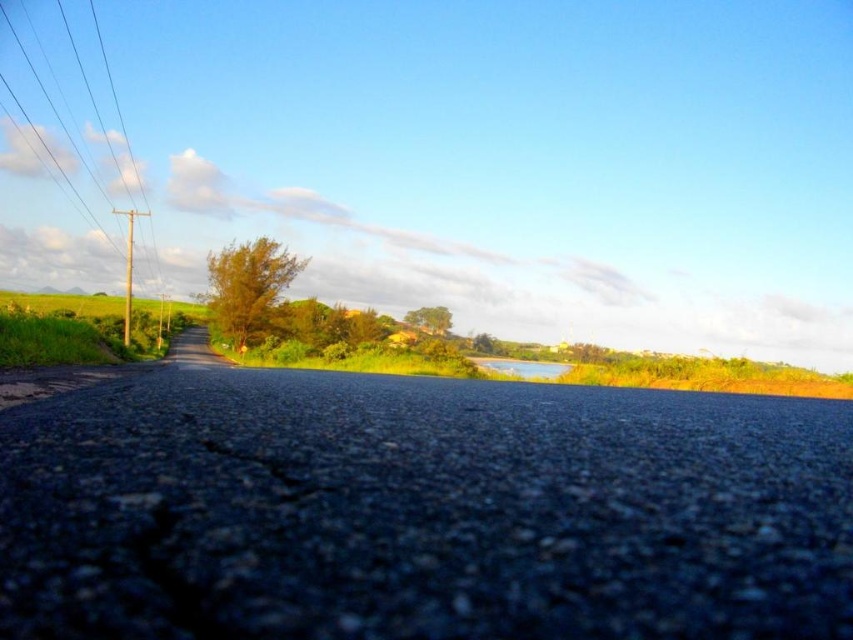
Question: Does green leafy bush at center come behind dark asphalt crack at center?

Choices:
 (A) yes
 (B) no

Answer: (A)

Question: Which point is closer to the camera taking this photo?

Choices:
 (A) (15, 17)
 (B) (260, 305)

Answer: (B)

Question: Considering the relative positions of green leafy bush at center and dark asphalt crack at center in the image provided, where is green leafy bush at center located with respect to dark asphalt crack at center?

Choices:
 (A) above
 (B) below

Answer: (A)

Question: Which of these objects is positioned farthest from the green leafy tree at center?

Choices:
 (A) smooth wood pole at left
 (B) dark asphalt crack at center
 (C) green leafy bush at center

Answer: (B)

Question: Among these points, which one is farthest from the camera?

Choices:
 (A) (271, 262)
 (B) (230, 452)

Answer: (A)

Question: Can you confirm if smooth wood pole at left is smaller than green leafy bush at center?

Choices:
 (A) yes
 (B) no

Answer: (B)